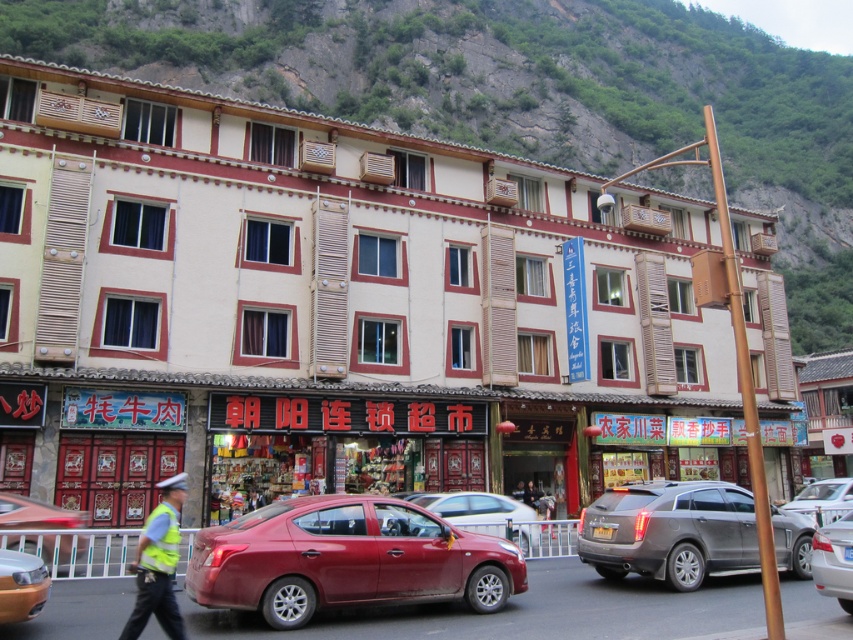
Question: Is green rock at upper center further to camera compared to shiny red sedan at lower left?

Choices:
 (A) yes
 (B) no

Answer: (A)

Question: Observing the image, what is the correct spatial positioning of black matte signboard at center in reference to reflective silver helmet at center?

Choices:
 (A) above
 (B) below

Answer: (A)

Question: Which object appears farthest from the camera in this image?

Choices:
 (A) yellow reflective vest at center
 (B) matte red car at center
 (C) matte red sedan at lower left
 (D) shiny red sedan at lower left

Answer: (A)

Question: Which point appears farthest from the camera in this image?

Choices:
 (A) (178, 621)
 (B) (218, 394)
 (C) (846, 492)

Answer: (B)

Question: Which is farther from the reflective silver helmet at center?

Choices:
 (A) yellow reflective vest at center
 (B) reflective yellow vest at center
 (C) black matte signboard at center

Answer: (A)

Question: Is silver metallic suv at center right further to the viewer compared to matte red sedan at lower left?

Choices:
 (A) no
 (B) yes

Answer: (B)